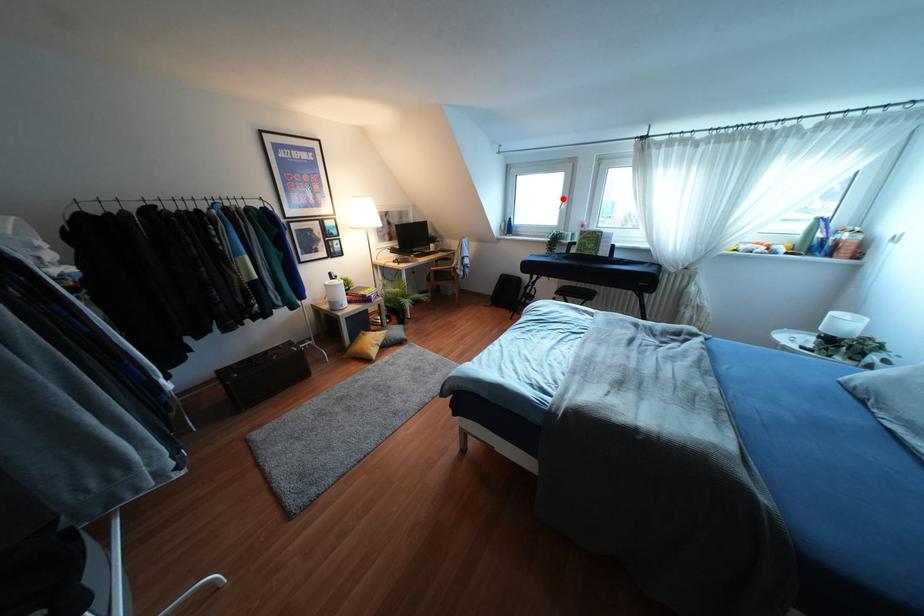
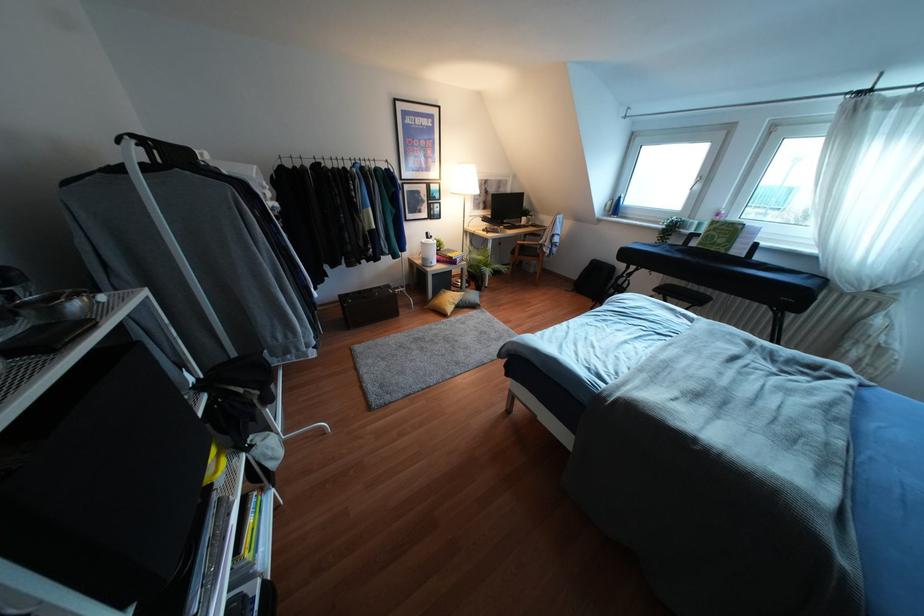
Find the pixel in the second image that matches the highlighted location in the first image.

(699, 177)